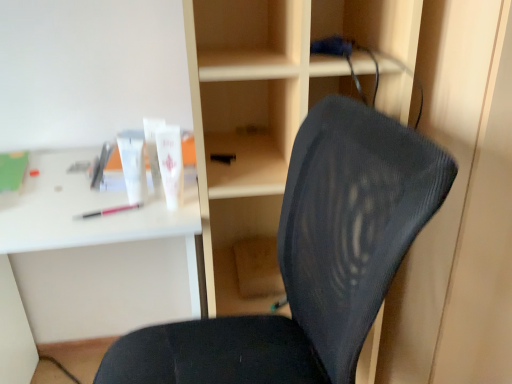
Locate an element on the screen. This screenshot has width=512, height=384. free region on the left part of white matte tube at upper left, the 1th toiletry in the left-to-right sequence is located at coordinates (84, 203).